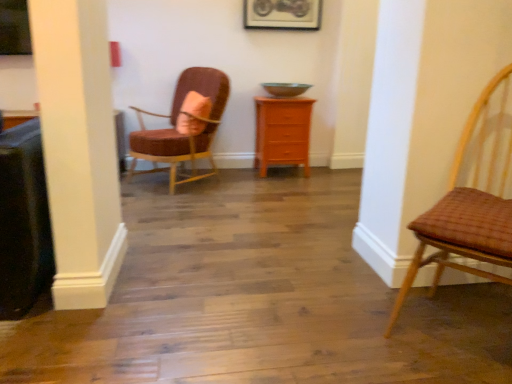
Find the location of a particular element. vacant space underneath velvet pink chair at upper left, the second chair when ordered from front to back (from a real-world perspective) is located at coordinates (180, 187).